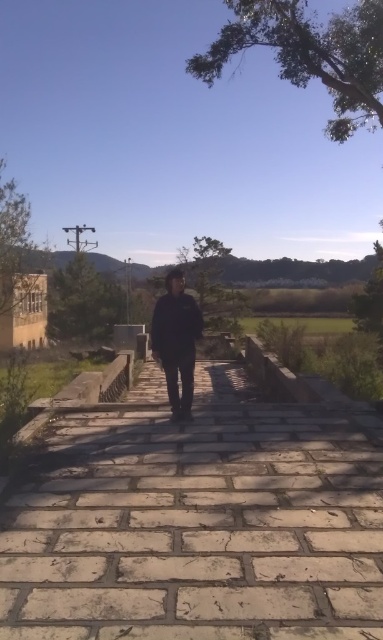
You are standing at the center of the light beige stone pavement at center. If you walk straight ahead, will you eventually reach the yellow building to the left?

The light beige stone pavement at center is located at point (199, 522). Since the yellow building is to the left of the pathway, walking straight ahead from the center of the pavement would not lead directly to the yellow building. You would need to adjust your direction towards the left to reach it.

You are a delivery drone flying above the scene. You need to land on the light beige stone pavement at center while avoiding the black matte jacket at center. Is the jacket in the way of the pavement?

The light beige stone pavement at center is below the black matte jacket at center, so the jacket is blocking the landing area. Choose another spot.